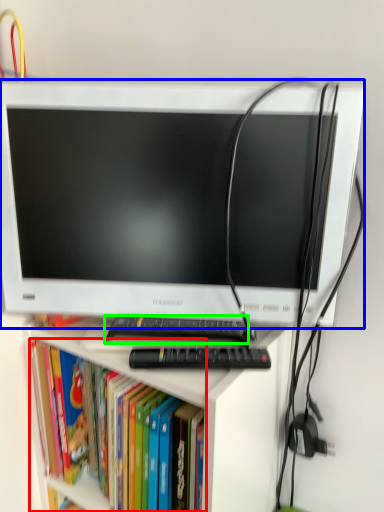
Question: Estimate the real-world distances between objects in this image. Which object is closer to book (highlighted by a red box), computer monitor (highlighted by a blue box) or keyboard (highlighted by a green box)?

Choices:
 (A) computer monitor
 (B) keyboard

Answer: (B)